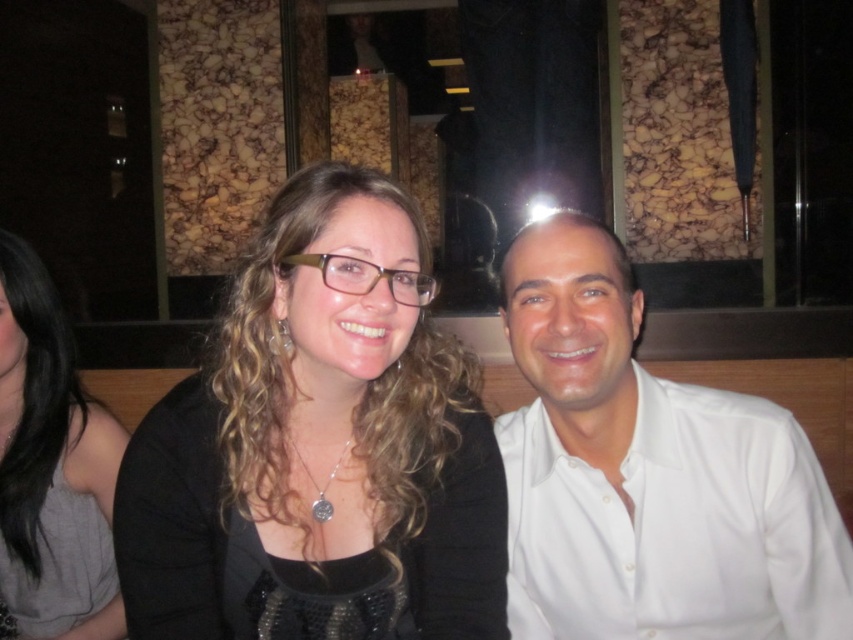
Which is more to the left, black matte hair at center or white smooth shirt at center?

black matte hair at center is more to the left.

Can you confirm if black matte hair at center is positioned to the left of white smooth shirt at center?

Indeed, black matte hair at center is positioned on the left side of white smooth shirt at center.

Who is more distant from viewer, (252, 456) or (532, 221)?

Point (532, 221)

The image size is (853, 640). Identify the location of black matte hair at center. (320, 445).

In the scene shown: Is white smooth shirt at center taller than matte black dress at center?

No, white smooth shirt at center is not taller than matte black dress at center.

Between point (590, 621) and point (16, 612), which one is positioned in front?

Positioned in front is point (590, 621).

Between point (618, 524) and point (68, 509), which one is positioned in front?

Point (618, 524)

You are a GUI agent. You are given a task and a screenshot of the screen. Output one action in this format:
    pyautogui.click(x=<x>, y=<y>)
    Task: Click on the white smooth shirt at center
    
    Given the screenshot: What is the action you would take?
    pyautogui.click(x=648, y=474)

Which is behind, point (364, 637) or point (61, 369)?

The point (61, 369) is behind.

Locate an element on the screen. black matte hair at center is located at coordinates (320, 445).